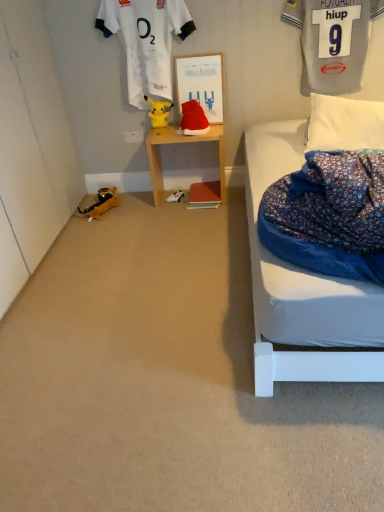
Where is `vacant space in between yellow rubber duck at lower left, which is the 3th toy from right to left, and wooden nightstand at center`? vacant space in between yellow rubber duck at lower left, which is the 3th toy from right to left, and wooden nightstand at center is located at coordinates (142, 204).